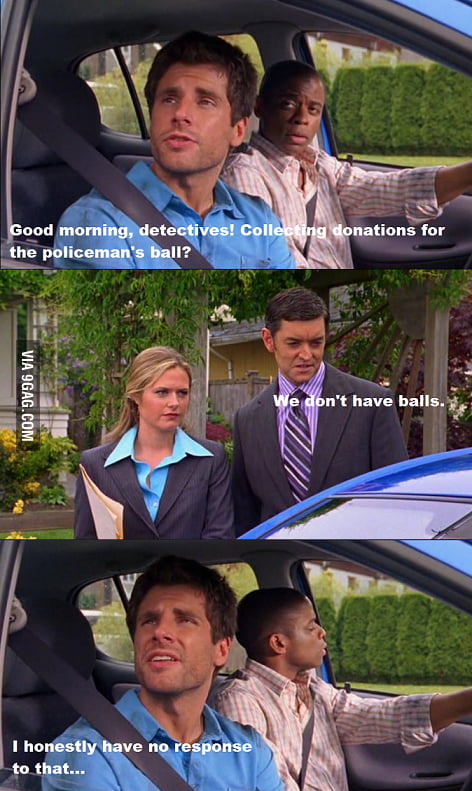
Locate an element on the screen. door handle is located at coordinates (429, 780).